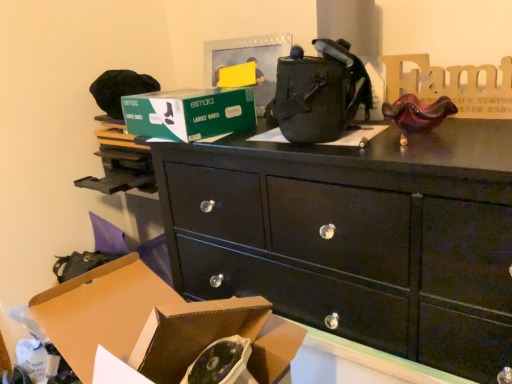
Question: Which direction should I rotate to face green cardboard box at upper center, arranged as the 1th box when viewed from the back, — up or down?

Choices:
 (A) up
 (B) down

Answer: (A)

Question: Is green cardboard box at upper center, placed as the 2th box when sorted from front to back, smaller than brown cardboard box at lower left, the first box from the front?

Choices:
 (A) yes
 (B) no

Answer: (A)

Question: Is green cardboard box at upper center, which is the 1th box from top to bottom, shorter than brown cardboard box at lower left, which is the 2th box from back to front?

Choices:
 (A) yes
 (B) no

Answer: (A)

Question: Is green cardboard box at upper center, the second box when ordered from bottom to top, looking in the opposite direction of brown cardboard box at lower left, which is the 2th box from back to front?

Choices:
 (A) no
 (B) yes

Answer: (A)

Question: Could you tell me if green cardboard box at upper center, arranged as the 1th box when viewed from the back, is turned towards brown cardboard box at lower left, the first box in the bottom-to-top sequence?

Choices:
 (A) no
 (B) yes

Answer: (A)

Question: Is green cardboard box at upper center, arranged as the 1th box when viewed from the back, not close to brown cardboard box at lower left, which is the 2th box from back to front?

Choices:
 (A) no
 (B) yes

Answer: (A)

Question: From a real-world perspective, is green cardboard box at upper center, the second box when ordered from bottom to top, located beneath brown cardboard box at lower left, which is the 2th box from back to front?

Choices:
 (A) yes
 (B) no

Answer: (B)

Question: Is brown cardboard box at lower left, the first box in the bottom-to-top sequence, further to camera compared to green cardboard box at upper center, placed as the 2th box when sorted from front to back?

Choices:
 (A) yes
 (B) no

Answer: (B)

Question: Does brown cardboard box at lower left, the first box from the front, turn towards green cardboard box at upper center, which is the 1th box from top to bottom?

Choices:
 (A) no
 (B) yes

Answer: (A)

Question: From the image's perspective, is brown cardboard box at lower left, the first box from the front, over green cardboard box at upper center, placed as the 2th box when sorted from front to back?

Choices:
 (A) no
 (B) yes

Answer: (A)

Question: Is brown cardboard box at lower left, the first box in the bottom-to-top sequence, in contact with green cardboard box at upper center, arranged as the 1th box when viewed from the back?

Choices:
 (A) yes
 (B) no

Answer: (B)

Question: Considering the relative sizes of brown cardboard box at lower left, the first box from the front, and green cardboard box at upper center, the second box when ordered from bottom to top, in the image provided, is brown cardboard box at lower left, the first box from the front, smaller than green cardboard box at upper center, the second box when ordered from bottom to top,?

Choices:
 (A) yes
 (B) no

Answer: (B)

Question: Is brown cardboard box at lower left, the first box in the bottom-to-top sequence, at the right side of green cardboard box at upper center, which is the 1th box from top to bottom?

Choices:
 (A) yes
 (B) no

Answer: (A)

Question: Is green cardboard box at upper center, arranged as the 1th box when viewed from the back, inside black glossy chest of drawers at center?

Choices:
 (A) yes
 (B) no

Answer: (B)